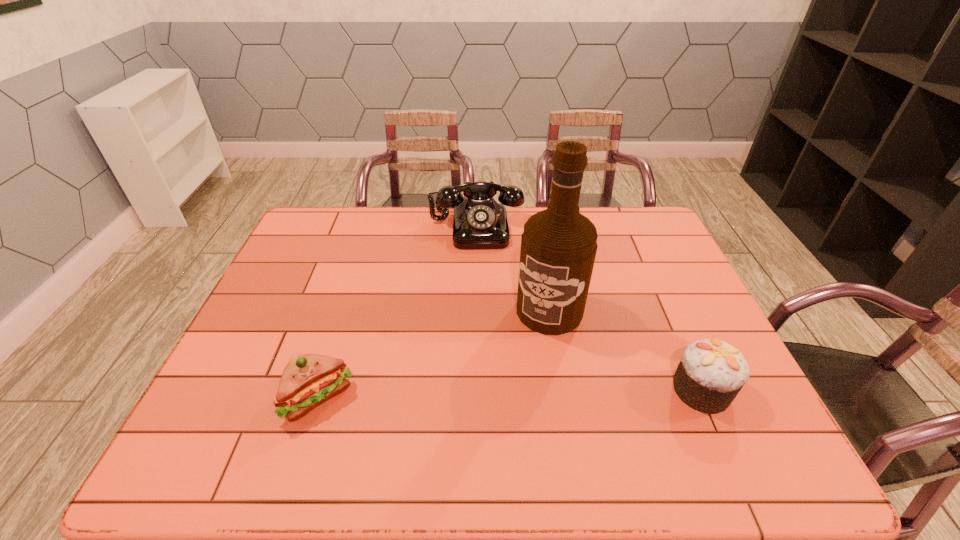
Image resolution: width=960 pixels, height=540 pixels. What are the coordinates of `free location at the right edge` in the screenshot? It's located at (655, 264).

Where is `free spot between the cupcake and the telephone`? This screenshot has height=540, width=960. free spot between the cupcake and the telephone is located at coordinates (589, 308).

The image size is (960, 540). Identify the location of vacant region between the farthest object and the alcohol. (513, 269).

This screenshot has width=960, height=540. What are the coordinates of `free point between the leftmost object and the tallest object` in the screenshot? It's located at (434, 354).

At what (x,y) coordinates should I click in order to perform the action: click on unoccupied area between the alcohol and the telephone. Please return your answer as a coordinate pair (x, y). This screenshot has height=540, width=960. Looking at the image, I should click on (513, 269).

What are the coordinates of `empty space that is in between the third nearest object and the sandwich` in the screenshot? It's located at (434, 354).

The width and height of the screenshot is (960, 540). I want to click on vacant area that lies between the rightmost object and the leftmost object, so click(510, 394).

In order to click on vacant space that is in between the sandwich and the third nearest object in this screenshot , I will do `click(434, 354)`.

Locate an element on the screen. Image resolution: width=960 pixels, height=540 pixels. free space between the alcohol and the telephone is located at coordinates (513, 269).

This screenshot has width=960, height=540. I want to click on free spot between the sandwich and the alcohol, so click(434, 354).